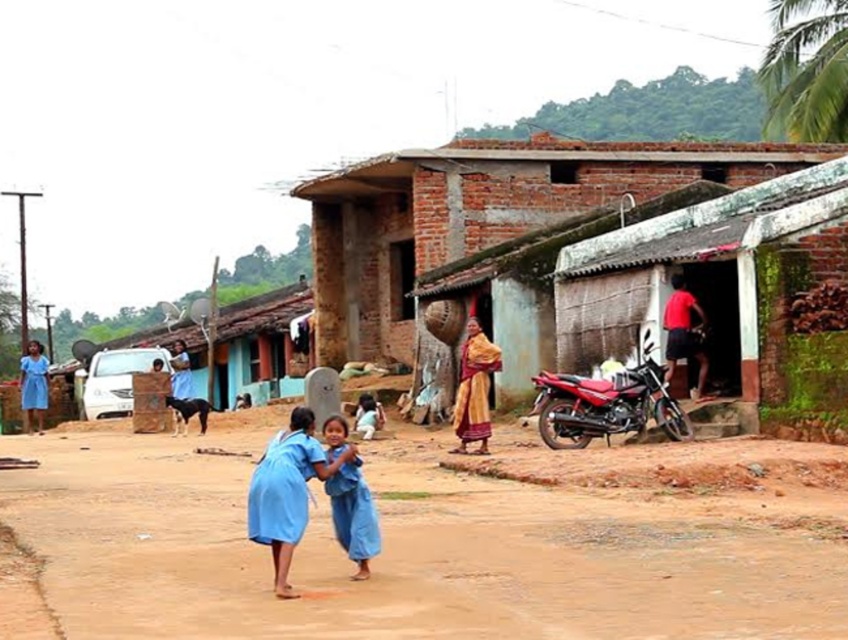
Question: Is brown sandy dirt at center to the left of brown brick hut at center from the viewer's perspective?

Choices:
 (A) no
 (B) yes

Answer: (A)

Question: Where is brown sandy dirt at center located in relation to brick wall hut at center in the image?

Choices:
 (A) left
 (B) right

Answer: (A)

Question: Which point appears closest to the camera in this image?

Choices:
 (A) (628, 388)
 (B) (305, 300)
 (C) (344, 426)
 (D) (481, 424)

Answer: (C)

Question: Can you confirm if brown sandy dirt at center is thinner than brick wall hut at center?

Choices:
 (A) no
 (B) yes

Answer: (B)

Question: Which of the following is the farthest from the observer?

Choices:
 (A) (462, 381)
 (B) (636, 404)
 (C) (339, 428)
 (D) (711, 611)

Answer: (A)

Question: Which object is positioned farthest from the brown sandy dirt at center?

Choices:
 (A) gold textured shawl at center
 (B) brick wall hut at center

Answer: (B)